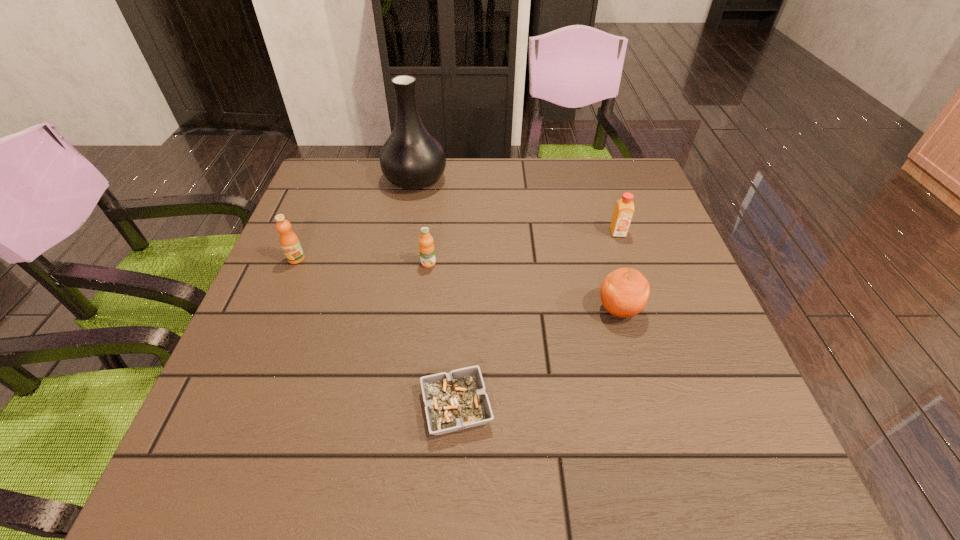
Locate an element on the screen. This screenshot has height=540, width=960. vacant space in between the nearest object and the second orange juice from left to right is located at coordinates (443, 335).

Locate an element on the screen. The height and width of the screenshot is (540, 960). blank region between the leftmost orange juice and the orange is located at coordinates (458, 284).

Image resolution: width=960 pixels, height=540 pixels. In order to click on free spot between the ashtray and the orange in this screenshot , I will do `click(538, 358)`.

At what (x,y) coordinates should I click in order to perform the action: click on vacant region between the second orange juice from right to left and the leftmost orange juice. Please return your answer as a coordinate pair (x, y). Looking at the image, I should click on (363, 261).

Locate an element on the screen. This screenshot has width=960, height=540. free area in between the vase and the second nearest object is located at coordinates (517, 244).

Identify which object is the fifth nearest to the tallest object. Please provide its 2D coordinates. Your answer should be formatted as a tuple, i.e. [(x, y)], where the tuple contains the x and y coordinates of a point satisfying the conditions above.

[(457, 400)]

Identify which object is the fourth nearest to the second nearest object. Please provide its 2D coordinates. Your answer should be formatted as a tuple, i.e. [(x, y)], where the tuple contains the x and y coordinates of a point satisfying the conditions above.

[(412, 158)]

Image resolution: width=960 pixels, height=540 pixels. In order to click on orange juice that can be found as the closest to the farthest orange juice in this screenshot , I will do `click(426, 247)`.

Locate which orange juice is the closest to the leftmost orange juice. Please provide its 2D coordinates. Your answer should be formatted as a tuple, i.e. [(x, y)], where the tuple contains the x and y coordinates of a point satisfying the conditions above.

[(426, 247)]

Locate an element on the screen. vacant space that satisfies the following two spatial constraints: 1. on the front label of the ashtray; 2. on the left side of the leftmost object is located at coordinates (234, 407).